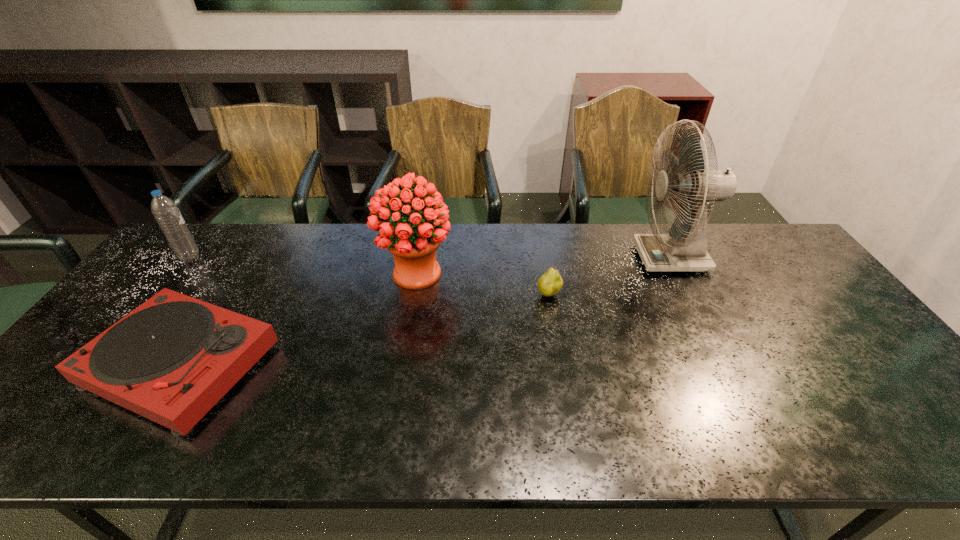
I want to click on blank area located on the front of the third object from left to right, so tap(407, 329).

Locate an element on the screen. The image size is (960, 540). free point located on the back of the third tallest object is located at coordinates (205, 238).

Find the location of a particular element. free region located 0.050m on the front of the pear is located at coordinates (553, 316).

Locate an element on the screen. This screenshot has width=960, height=540. free space located on the right of the record player is located at coordinates (405, 364).

The height and width of the screenshot is (540, 960). In order to click on fan present at the far edge in this screenshot , I will do `click(684, 249)`.

I want to click on bouquet that is at the far edge, so [413, 242].

Locate an element on the screen. The image size is (960, 540). water bottle that is at the far edge is located at coordinates (165, 211).

You are a GUI agent. You are given a task and a screenshot of the screen. Output one action in this format:
    pyautogui.click(x=<x>, y=<y>)
    Task: Click on the object at the near edge
    
    Given the screenshot: What is the action you would take?
    pyautogui.click(x=170, y=360)

You are a GUI agent. You are given a task and a screenshot of the screen. Output one action in this format:
    pyautogui.click(x=<x>, y=<y>)
    Task: Click on the water bottle at the left edge
    The width and height of the screenshot is (960, 540).
    Given the screenshot: What is the action you would take?
    pyautogui.click(x=165, y=211)

What are the coordinates of `record player situated at the left edge` in the screenshot? It's located at (170, 360).